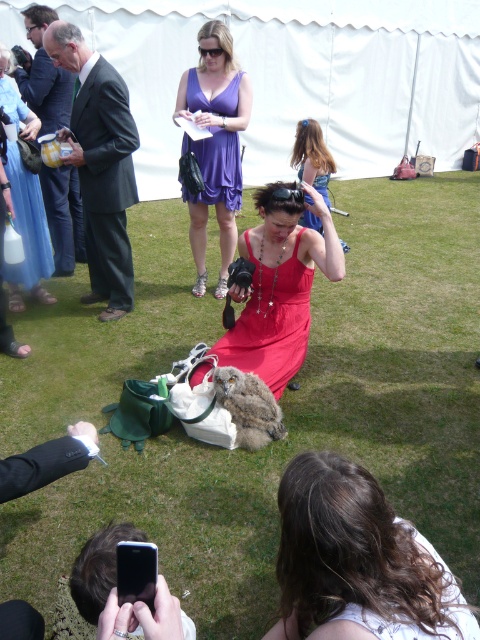
You are a photographer at the event and need to frame both the fuzzy brown owl at center and the matte purple dress at center in your shot. Which object is narrower so that it can fit better in the frame?

Answer: The fuzzy brown owl at center is narrower than the matte purple dress at center, so it will fit better in the frame.

You are standing at the edge of the garden party scene. You see the green grass at center and the purple satin dress at upper center. Which object is positioned higher in the image?

The purple satin dress at upper center is positioned higher than the green grass at center.